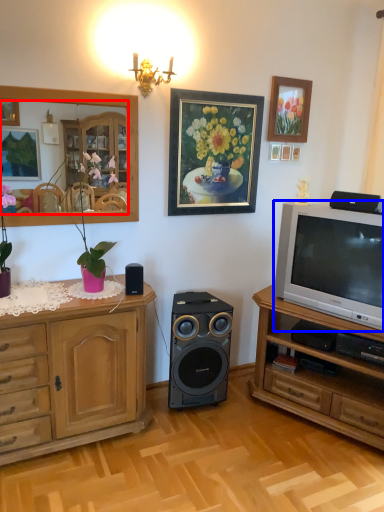
Question: Which of the following is the farthest to the observer, mirror (highlighted by a red box) or television (highlighted by a blue box)?

Choices:
 (A) mirror
 (B) television

Answer: (B)